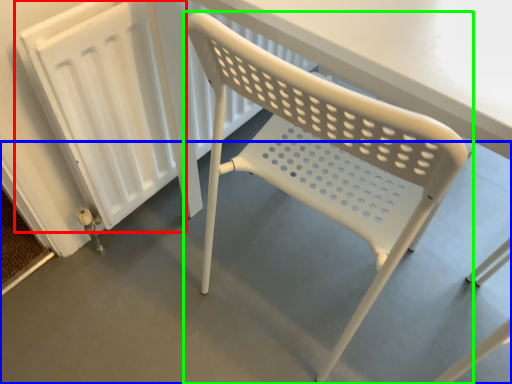
Question: Estimate the real-world distances between objects in this image. Which object is farther from radiator (highlighted by a red box), concrete (highlighted by a blue box) or chair (highlighted by a green box)?

Choices:
 (A) concrete
 (B) chair

Answer: (A)